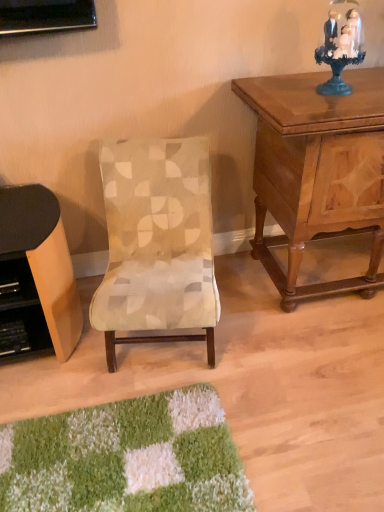
Find the location of `vacant area that is in front of blue glass figurine at upper right`. vacant area that is in front of blue glass figurine at upper right is located at coordinates (338, 106).